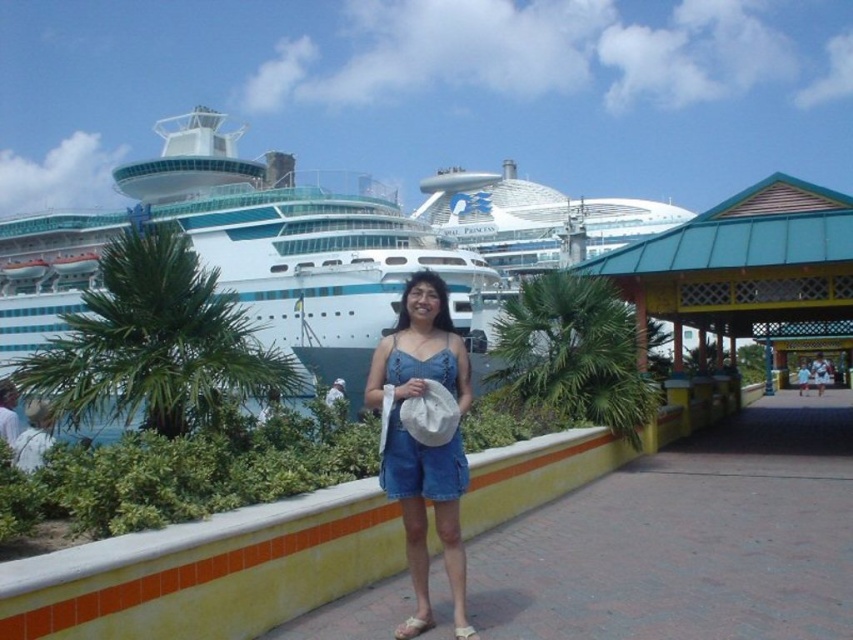
You are a photographer trying to capture the woman in the scene. To ensure the denim shorts at center are in focus, where should you aim the camera?

The denim shorts at center are located at point (422, 444), so aim the camera at that coordinate to ensure they are in focus.